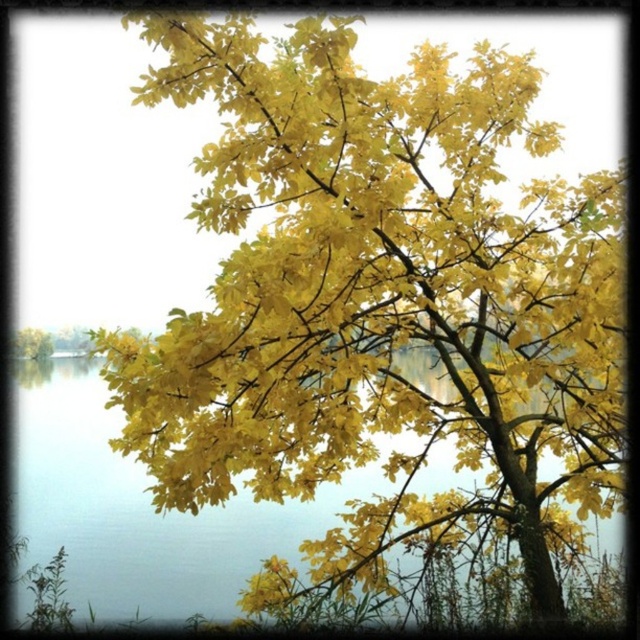
You are standing in front of the tree with golden leaves and want to find the transparent water at center. According to the coordinates provided, where should you look relative to the tree?

The transparent water at center is located at coordinates point (131, 512), so you should look towards the center of the image, slightly to the right and lower than the center point to find it.

You are an artist trying to paint the scene. You want to ensure the transparent water at center and yellow matte tree at left are positioned correctly. Based on the scene, which object should appear closer to the viewer?

The transparent water at center should appear closer to the viewer because it is in front of the yellow matte tree at left.